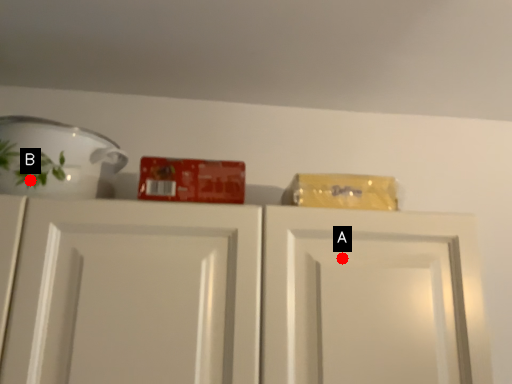
Question: Two points are circled on the image, labeled by A and B beside each circle. Which of the following is the closest to the observer?

Choices:
 (A) A is closer
 (B) B is closer

Answer: (A)